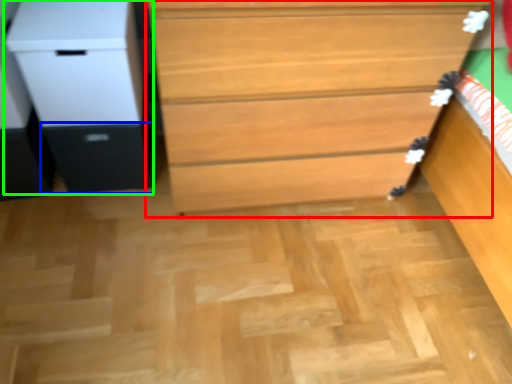
Question: Which object is the closest to the chest of drawers (highlighted by a red box)? Choose among these: drawer (highlighted by a blue box) or file cabinet (highlighted by a green box).

Choices:
 (A) drawer
 (B) file cabinet

Answer: (B)